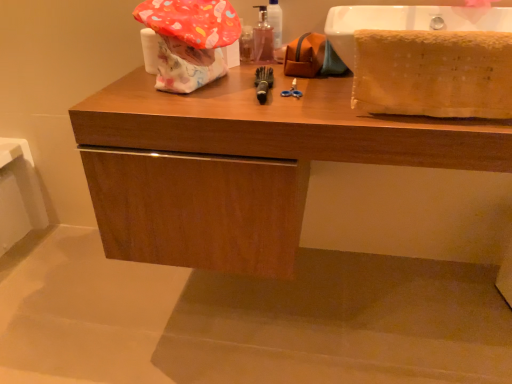
Locate an element on the screen. vacant area that is in front of translucent plastic mouthwash at center is located at coordinates (256, 78).